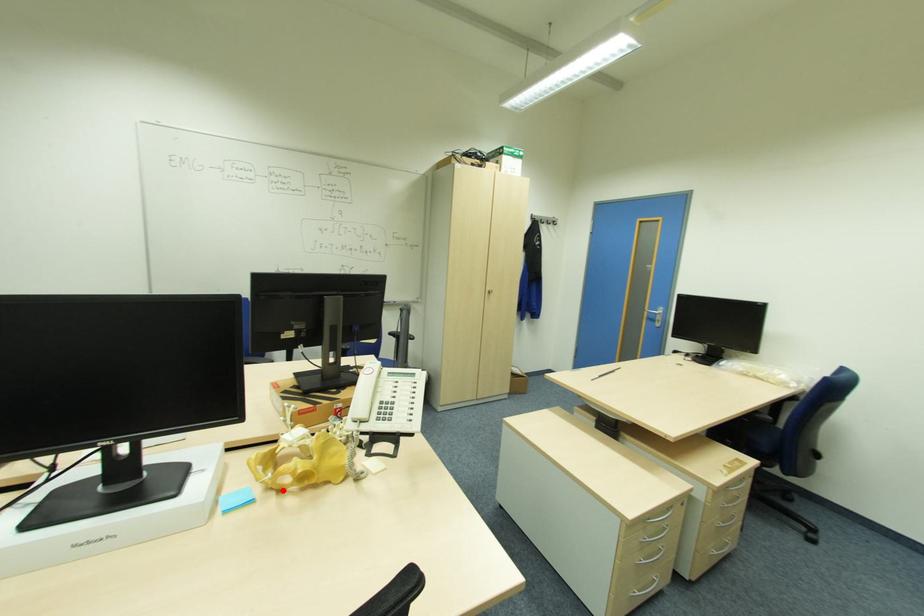
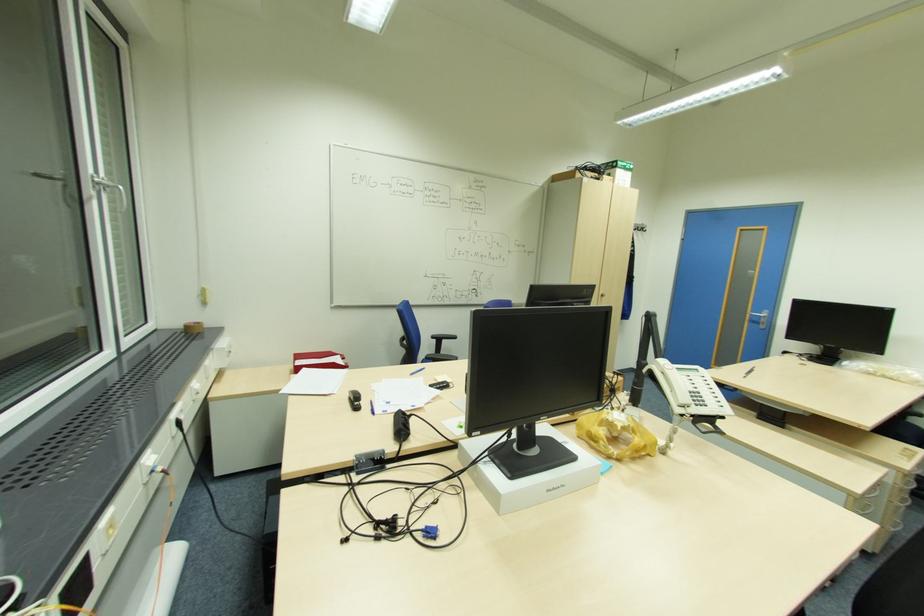
Question: I am providing you with two images of the same scene from different viewpoints. A red point is marked on the first image. At the location where the point appears in image 1, is it still visible in image 2?

Choices:
 (A) Yes
 (B) No

Answer: (A)